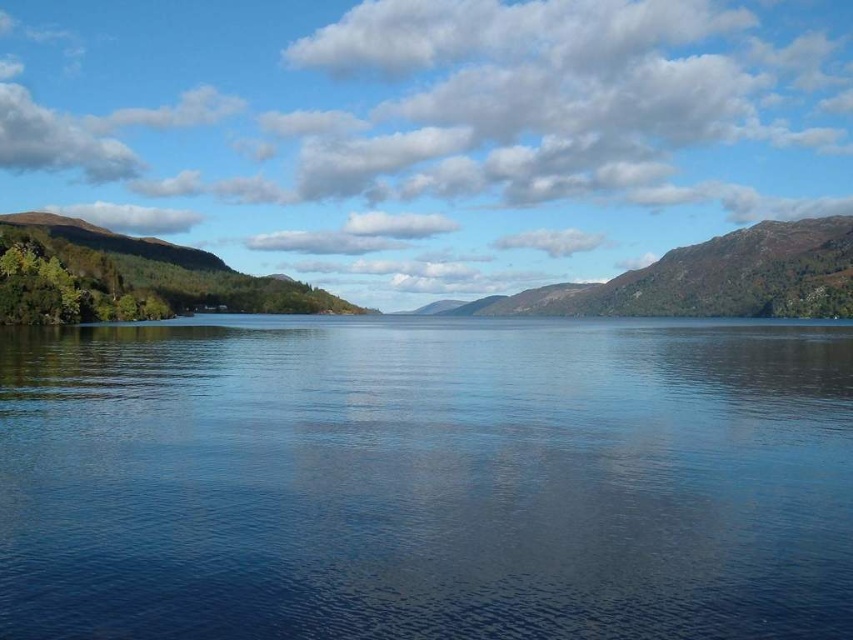
You are an explorer standing at the edge of the lake. You need to cross to the other side. You see the green textured hillside at left and the green mossy rock at center. Which object is wider and can provide a better path for crossing?

The green mossy rock at center is wider than the green textured hillside at left, so it can provide a better path for crossing.